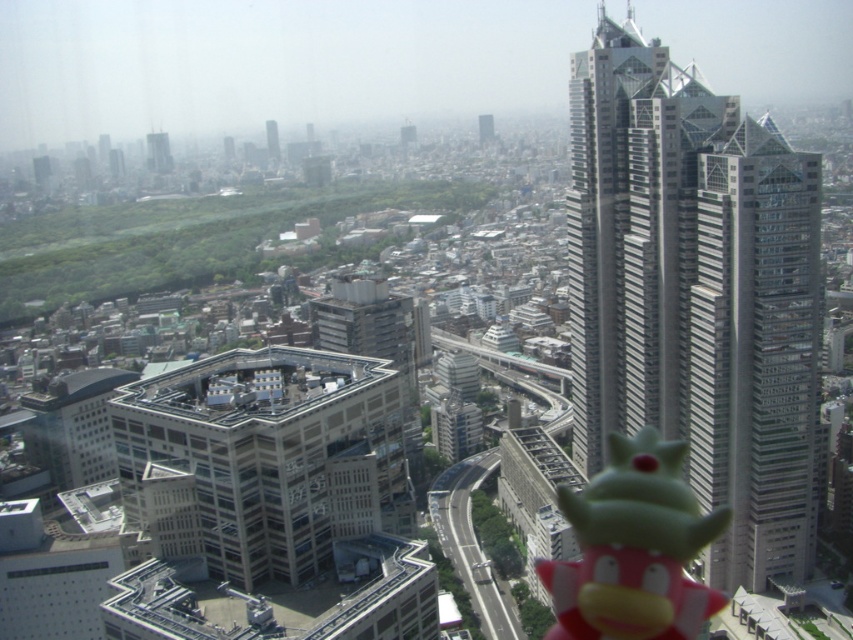
Question: Which object is positioned closest to the green rubber toy at center?

Choices:
 (A) gray concrete skyscraper at upper left
 (B) silver glass skyscraper at upper right
 (C) gray concrete skyscraper at upper center

Answer: (B)

Question: Can you confirm if green rubber toy at center is positioned to the left of gray concrete skyscraper at upper left?

Choices:
 (A) no
 (B) yes

Answer: (A)

Question: Does green rubber toy at center appear on the right side of gray concrete skyscraper at upper left?

Choices:
 (A) yes
 (B) no

Answer: (A)

Question: Is white concrete building at center wider than gray concrete skyscraper at upper left?

Choices:
 (A) no
 (B) yes

Answer: (B)

Question: Which object is the closest to the silver glass skyscraper at upper right?

Choices:
 (A) white concrete building at center
 (B) gray concrete skyscraper at upper center
 (C) gray concrete skyscraper at upper left
 (D) green rubber toy at center

Answer: (D)

Question: Which object is farther from the camera taking this photo?

Choices:
 (A) green rubber toy at center
 (B) silver glass skyscraper at upper right
 (C) gray concrete skyscraper at upper center
 (D) gray concrete skyscraper at upper left

Answer: (D)